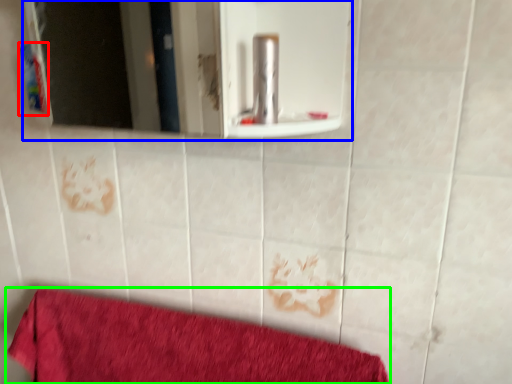
Question: Which is nearer to the toiletry (highlighted by a red box)? mirror (highlighted by a blue box) or towel (highlighted by a green box).

Choices:
 (A) mirror
 (B) towel

Answer: (B)